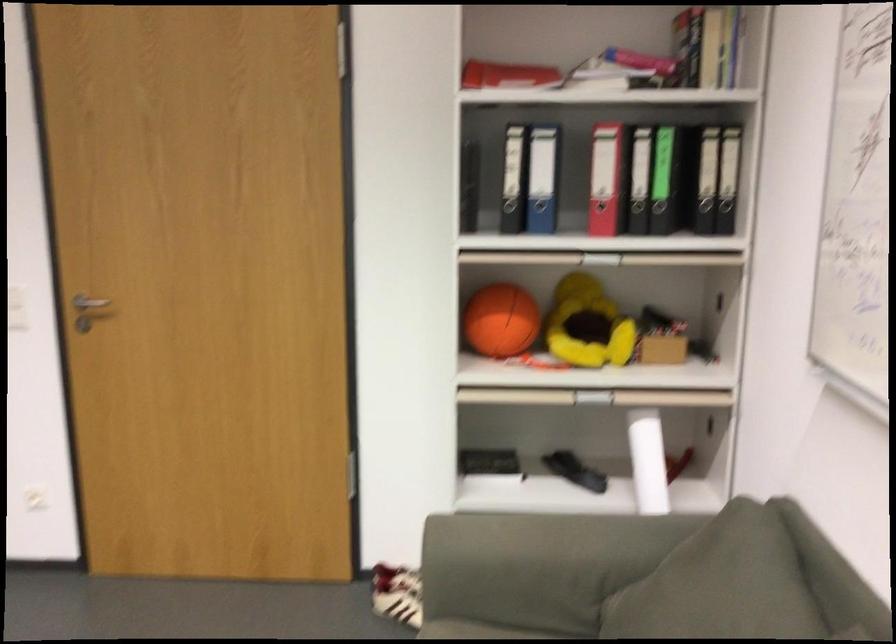
Where would you pull the red binder hole? Please return your answer as a coordinate pair (x, y).

(506, 75)